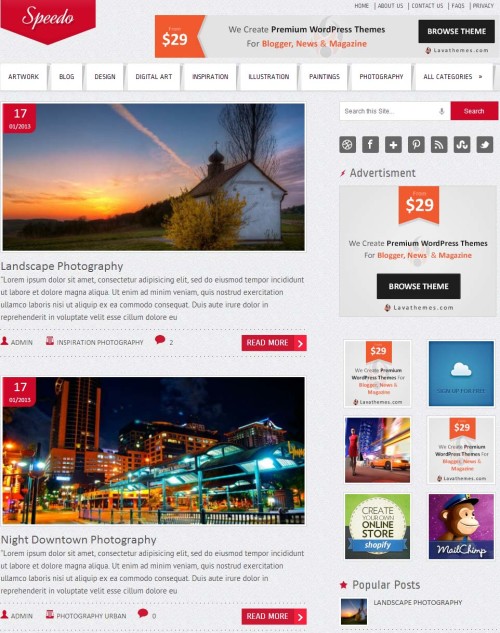
You are a GUI agent. You are given a task and a screenshot of the screen. Output one action in this format:
    pyautogui.click(x=<x>, y=<y>)
    Task: Click on the artwork tab
    The width and height of the screenshot is (500, 633).
    Given the screenshot: What is the action you would take?
    pyautogui.click(x=22, y=85)